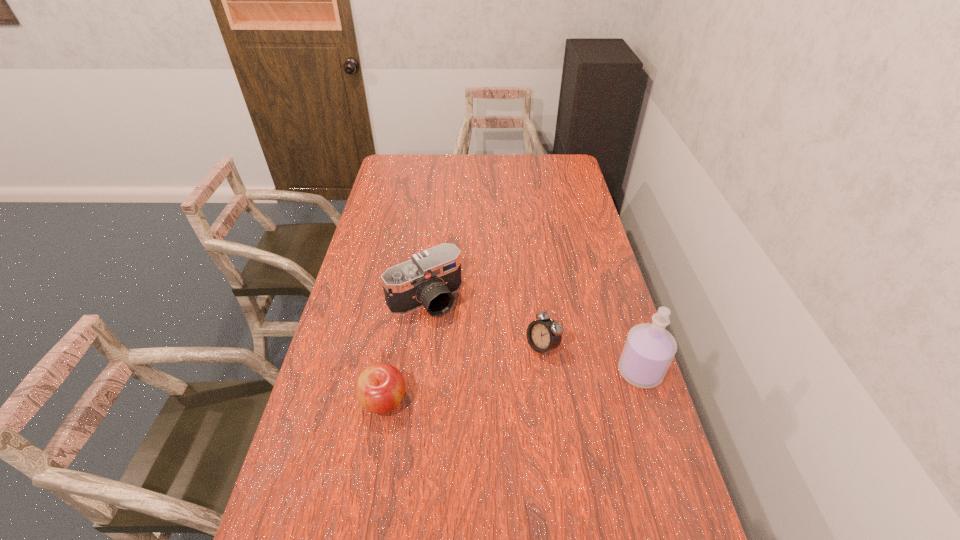
Find the location of a particular element. The height and width of the screenshot is (540, 960). object that can be found as the second closest to the apple is located at coordinates tap(543, 335).

I want to click on free location that satisfies the following two spatial constraints: 1. on the front side of the camera; 2. on the left side of the alarm clock, so click(419, 346).